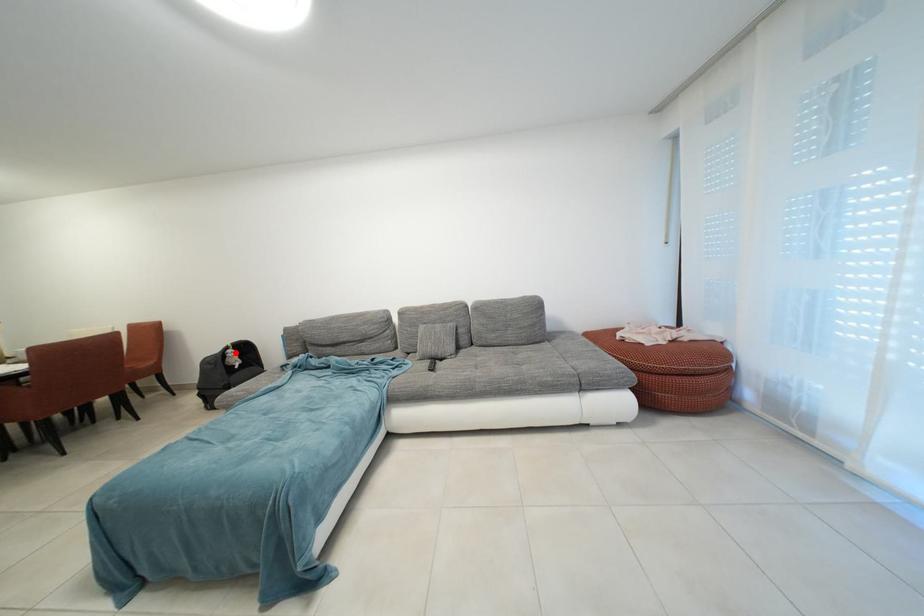
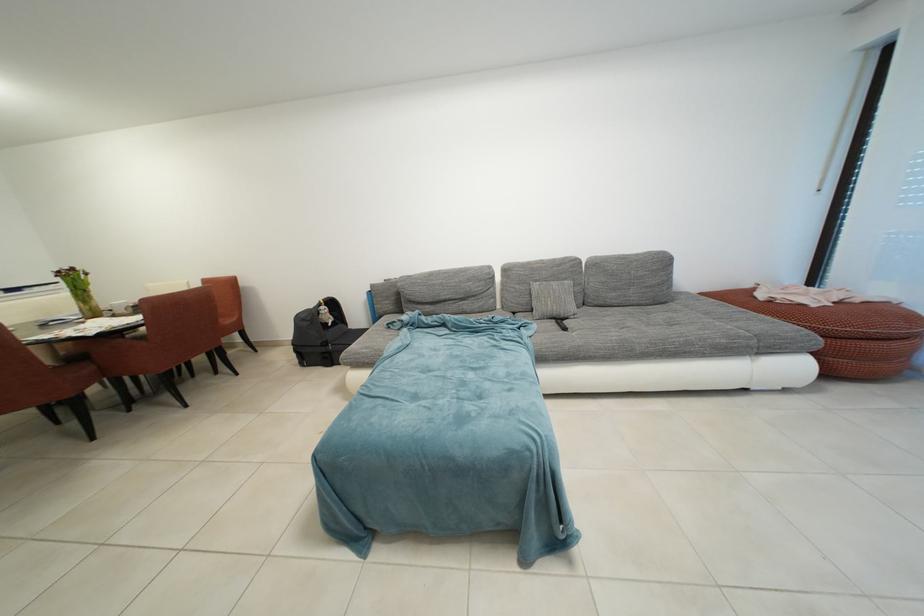
Question: I am providing you with two images of the same scene from different viewpoints. A red point is shown in image1. For the corresponding object point in image2, is it positioned nearer or farther from the camera?

Choices:
 (A) Nearer
 (B) Farther

Answer: (A)